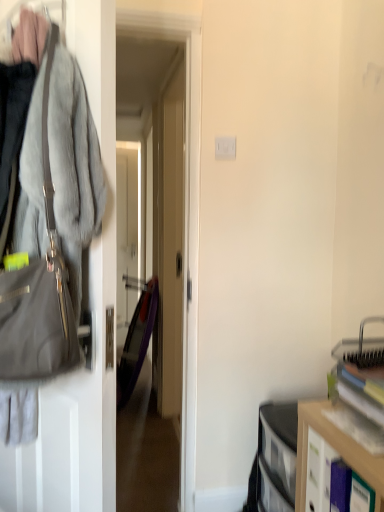
The height and width of the screenshot is (512, 384). I want to click on gray fabric bag at left, so click(93, 323).

Image resolution: width=384 pixels, height=512 pixels. What do you see at coordinates (93, 323) in the screenshot?
I see `gray fabric bag at left` at bounding box center [93, 323].

What is the approximate width of gray fabric bag at left?

15.86 centimeters.

Identify the location of gray fabric bag at left. This screenshot has height=512, width=384. (93, 323).